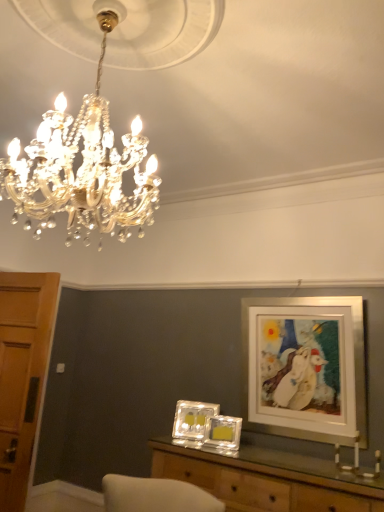
The image size is (384, 512). Identify the location of free space above wooden table at center (from a real-world perspective). (283, 462).